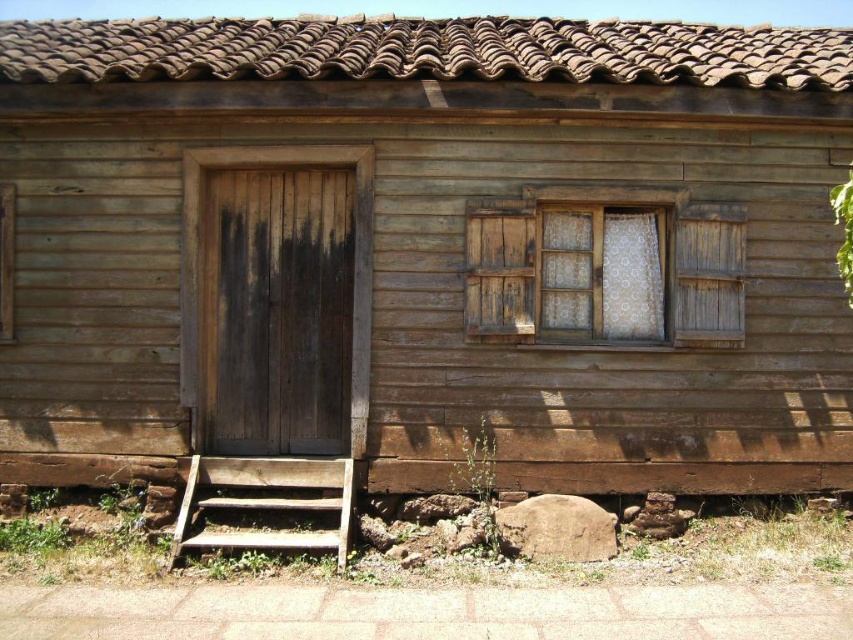
Question: Is weathered wood window at center below weathered wood stairs at lower left?

Choices:
 (A) yes
 (B) no

Answer: (B)

Question: Is weathered wood window at center positioned in front of weathered wood stairs at lower left?

Choices:
 (A) yes
 (B) no

Answer: (B)

Question: Does weathered wood window at center appear on the right side of weathered wood stairs at lower left?

Choices:
 (A) yes
 (B) no

Answer: (A)